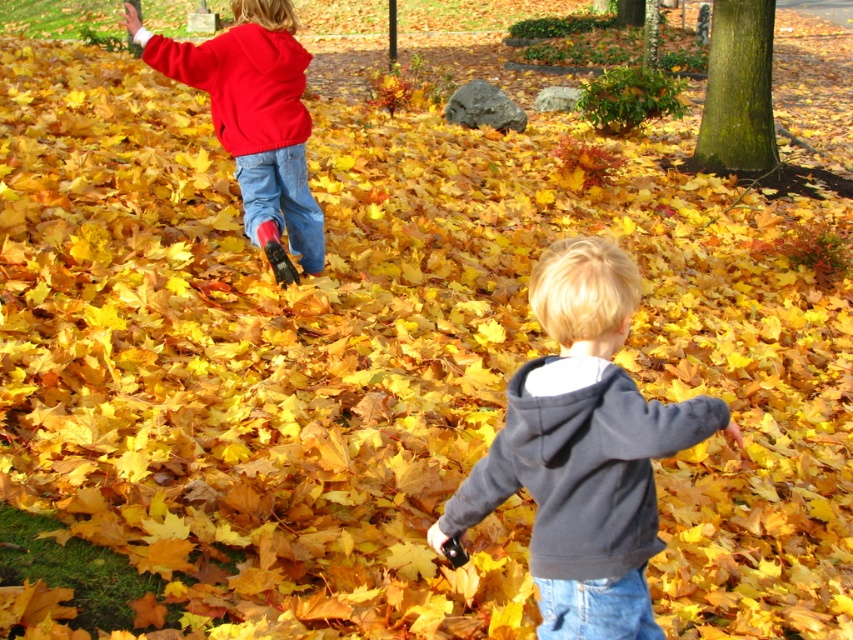
You are a photographer trying to capture both the dark gray hoodie at center and the matte red hoodie at upper left in a single frame. Which child should you focus on first to ensure both are in the shot?

You should focus on the matte red hoodie at upper left first because it is taller than the dark gray hoodie at center, ensuring both are visible in the frame.

You are standing at the point labeled as point (254, 115) in the image. What object are you touching?

The point (254, 115) is on the matte red hoodie at upper left, so you are touching the matte red hoodie at upper left.